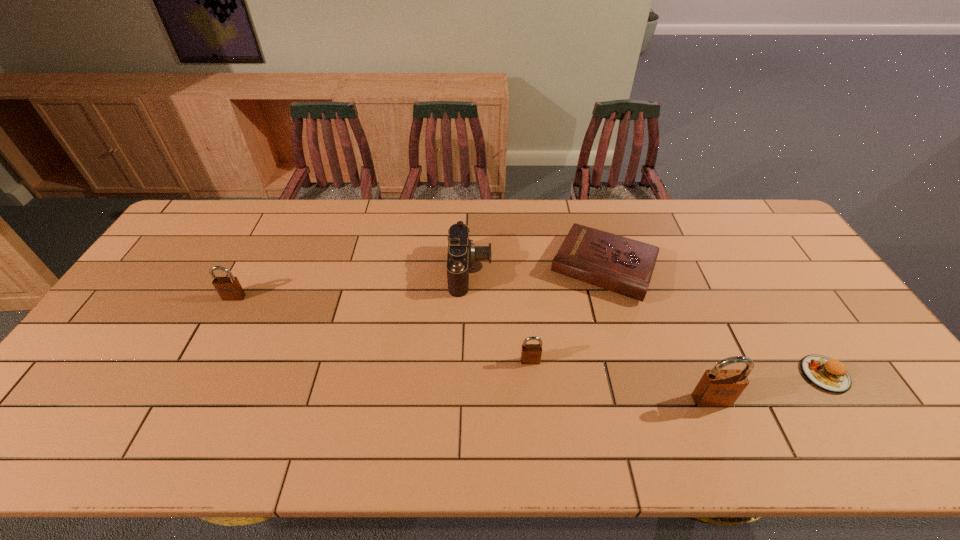
At what (x,y) coordinates should I click in order to perform the action: click on free spot between the leftmost padlock and the camera. Please return your answer as a coordinate pair (x, y). The width and height of the screenshot is (960, 540). Looking at the image, I should click on (352, 284).

The image size is (960, 540). Find the location of `free space that is in between the hardback book and the shortest object`. free space that is in between the hardback book and the shortest object is located at coordinates (714, 321).

The width and height of the screenshot is (960, 540). What are the coordinates of `free space between the farthest padlock and the third object from left to right` in the screenshot? It's located at (382, 329).

Image resolution: width=960 pixels, height=540 pixels. I want to click on free point between the second object from left to right and the rightmost padlock, so click(x=590, y=335).

Locate an element on the screen. This screenshot has width=960, height=540. empty location between the hardback book and the patty is located at coordinates (714, 321).

Where is `free space between the hardback book and the tallest padlock`? This screenshot has width=960, height=540. free space between the hardback book and the tallest padlock is located at coordinates pyautogui.click(x=658, y=334).

Point out which object is positioned as the nearest to the leftmost object. Please provide its 2D coordinates. Your answer should be formatted as a tuple, i.e. [(x, y)], where the tuple contains the x and y coordinates of a point satisfying the conditions above.

[(462, 253)]

I want to click on the closest object to the second nearest padlock, so click(622, 265).

The image size is (960, 540). Identify the location of padlock identified as the closest to the hardback book. (530, 353).

Image resolution: width=960 pixels, height=540 pixels. I want to click on padlock that stands as the third closest to the hardback book, so click(x=229, y=288).